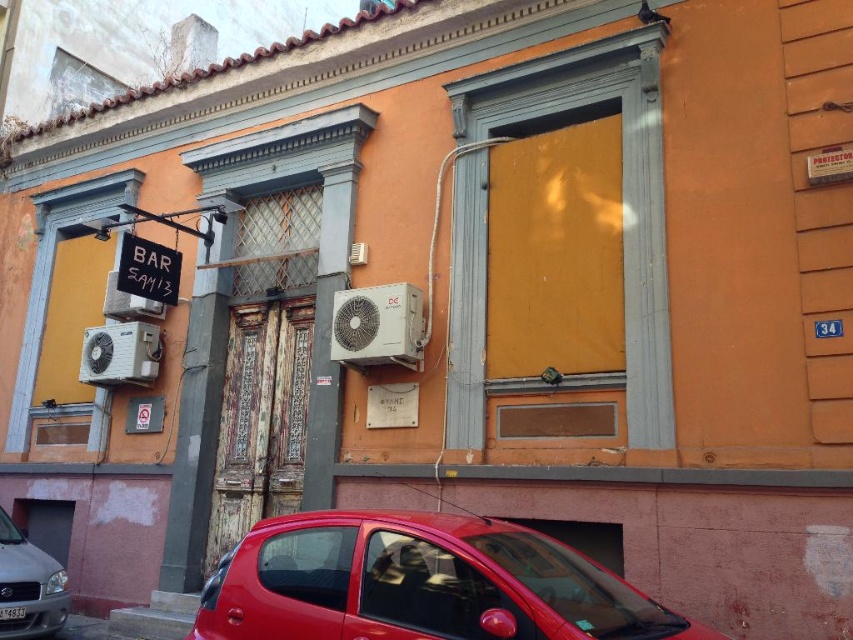
Question: Does glossy red car at lower center come behind white metallic air conditioner at lower left?

Choices:
 (A) no
 (B) yes

Answer: (A)

Question: Which is farther from the white metallic air conditioner at center?

Choices:
 (A) metallic silver car at lower left
 (B) glossy red car at lower center
 (C) white metallic air conditioner at upper left

Answer: (A)

Question: Which object appears closest to the camera in this image?

Choices:
 (A) glossy red car at lower center
 (B) white metallic air conditioner at lower left
 (C) white metallic air conditioner at upper left
 (D) white metallic air conditioner at center

Answer: (A)

Question: Can you confirm if metallic silver car at lower left is thinner than white metallic air conditioner at upper left?

Choices:
 (A) no
 (B) yes

Answer: (A)

Question: Which of the following is the closest to the observer?

Choices:
 (A) glossy red car at lower center
 (B) white metallic air conditioner at upper left

Answer: (A)

Question: Is metallic silver car at lower left thinner than white metallic air conditioner at upper left?

Choices:
 (A) yes
 (B) no

Answer: (B)